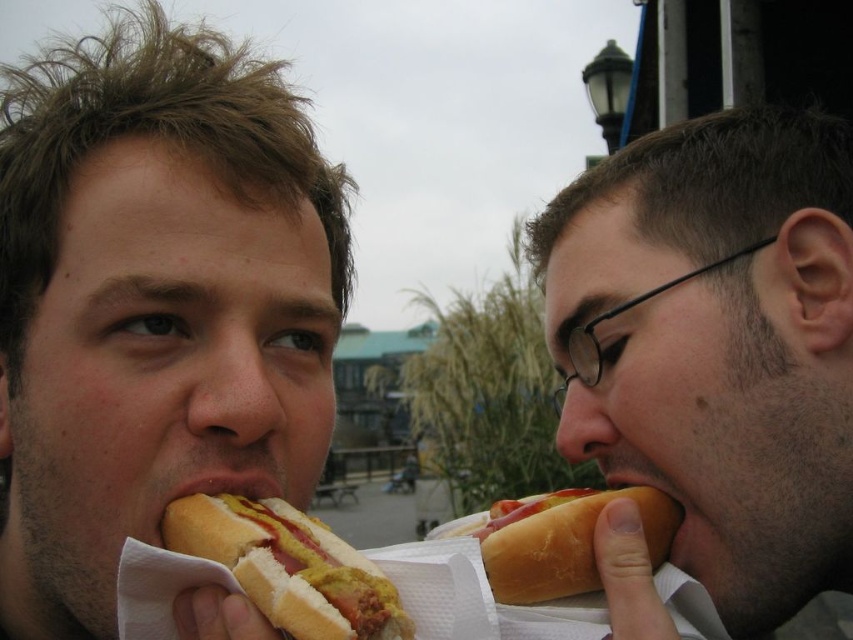
Question: Is yellow mustard bun at center positioned behind yellow mustard bun at lower left?

Choices:
 (A) no
 (B) yes

Answer: (B)

Question: Is the position of white bread hot dog at right less distant than that of smooth skin mouth at lower right?

Choices:
 (A) yes
 (B) no

Answer: (B)

Question: Among these points, which one is farthest from the camera?

Choices:
 (A) (28, 506)
 (B) (670, 529)
 (C) (517, 540)

Answer: (A)

Question: Among these points, which one is nearest to the camera?

Choices:
 (A) (228, 513)
 (B) (656, 556)
 (C) (817, 378)

Answer: (A)

Question: Estimate the real-world distances between objects in this image. Which object is closer to the yellow mustard bun at center?

Choices:
 (A) matte brown hair at center
 (B) smooth skin mouth at lower right
 (C) white bread hot dog at right

Answer: (C)

Question: Can you confirm if yellow mustard bun at lower left is bigger than white bread hot dog at right?

Choices:
 (A) no
 (B) yes

Answer: (B)